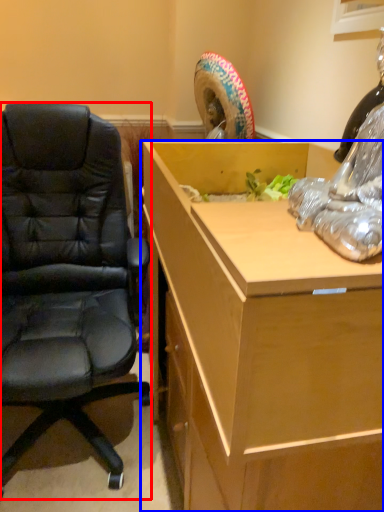
Question: Which point is closer to the camera, chair (highlighted by a red box) or desk (highlighted by a blue box)?

Choices:
 (A) chair
 (B) desk

Answer: (B)